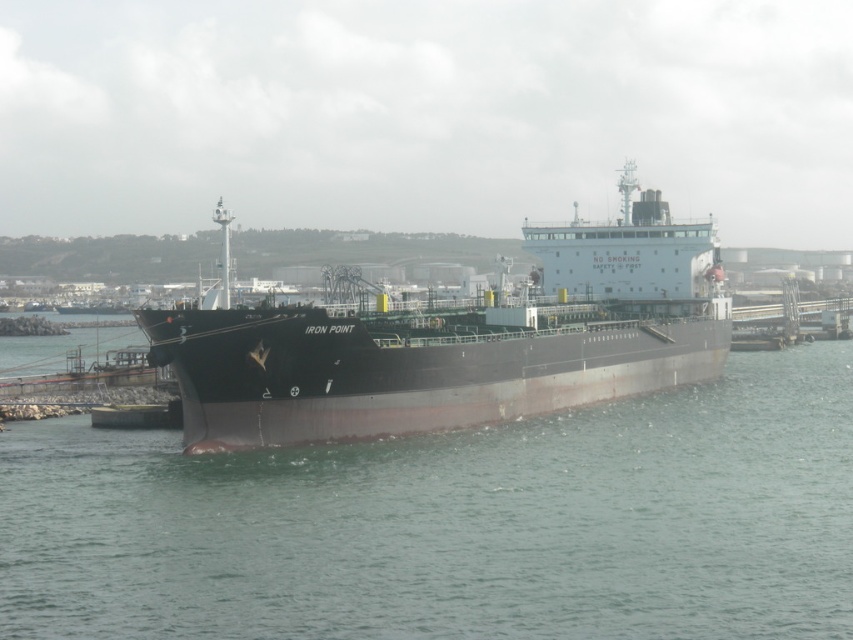
Looking at this image, you are a port authority inspector assessing the docking situation. You observe the green matte water at center and the black matte ship at center. Based on their relative heights, which one is lower in position?

The green matte water at center is shorter than the black matte ship at center, so the green matte water at center is lower in position.

You are a crane operator on the black matte ship at center. You need to lower a heavy container onto a barge that is currently positioned at the green matte water at center. The container requires a minimum clearance of 9 meters to avoid hitting the ship. Based on the scene description, can you safely lower the container without any collisions?

The distance between the green matte water at center and the black matte ship at center is 8.77 meters, which is less than the required 9 meters clearance. Therefore, lowering the container may result in a collision.

Based on the photo, you are a port inspector standing on the pier. You need to ensure that the green matte water at center and the black matte ship at center are positioned correctly according to safety regulations. From your vantage point, which object is located to the left?

The green matte water at center is to the left of the black matte ship at center according to the description.